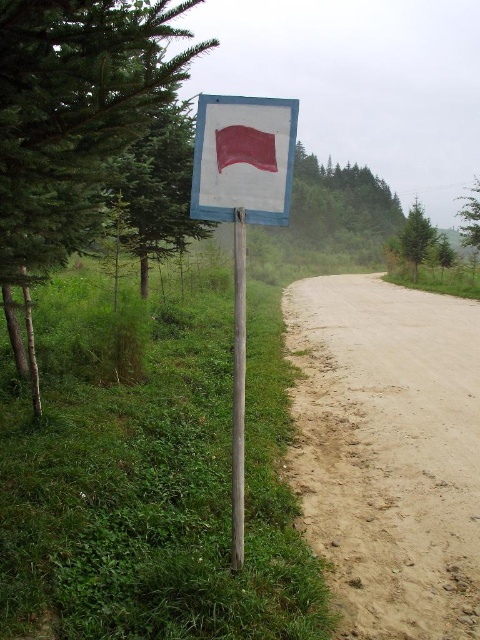
Question: Which point is farther from the camera taking this photo?

Choices:
 (A) (414, 278)
 (B) (364, 376)
 (C) (120, 112)
 (D) (249, 125)

Answer: (A)

Question: Can you confirm if green leafy tree at upper left is thinner than matte white flag at center?

Choices:
 (A) no
 (B) yes

Answer: (A)

Question: Can you confirm if blue painted wood pole at center is positioned above green matte tree at right?

Choices:
 (A) yes
 (B) no

Answer: (B)

Question: Which of the following is the farthest from the observer?

Choices:
 (A) matte red flag at center
 (B) matte white flag at center
 (C) green matte tree at right
 (D) green leafy tree at upper left

Answer: (C)

Question: Estimate the real-world distances between objects in this image. Which object is closer to the green leafy tree at upper left?

Choices:
 (A) blue painted wood pole at center
 (B) matte white flag at center

Answer: (B)

Question: In this image, where is matte white flag at center located relative to blue painted wood pole at center?

Choices:
 (A) above
 (B) below

Answer: (A)